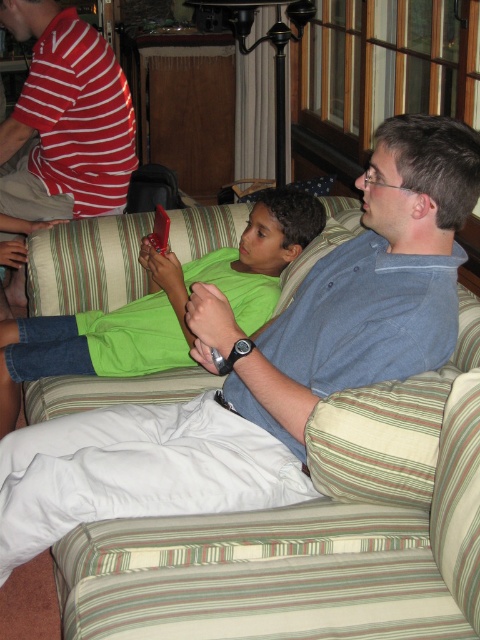
You are a photographer trying to capture a candid shot of both the green matte shirt at center and the red striped shirt at upper left. Since you can only focus on one person at a time, which person should you focus on first to ensure the other is still in frame?

The green matte shirt at center is positioned on the right side of red striped shirt at upper left, so focusing on the red striped shirt at upper left first would keep the green matte shirt at center within the frame as it is to the right.

You are designing a new living room layout and want to place a floor lamp next to the green striped fabric couch at center. The lamp must be shorter than the couch to avoid blocking the view. Is the rubberized plastic phone at center an appropriate height for the lamp?

The green striped fabric couch at center is taller than the rubberized plastic phone at center. Since the lamp needs to be shorter than the couch, the rubberized plastic phone at center could be a suitable height for the lamp as it is shorter than the couch.